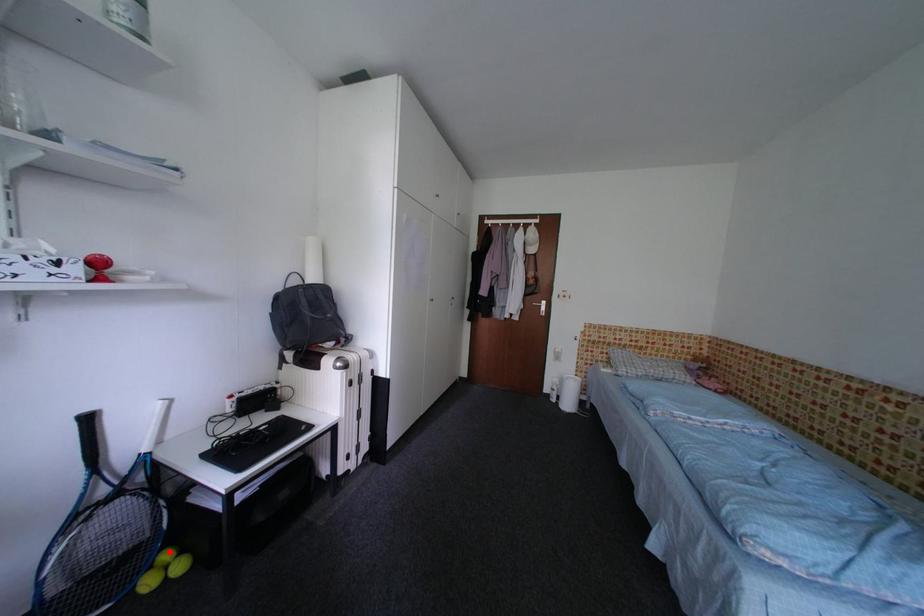
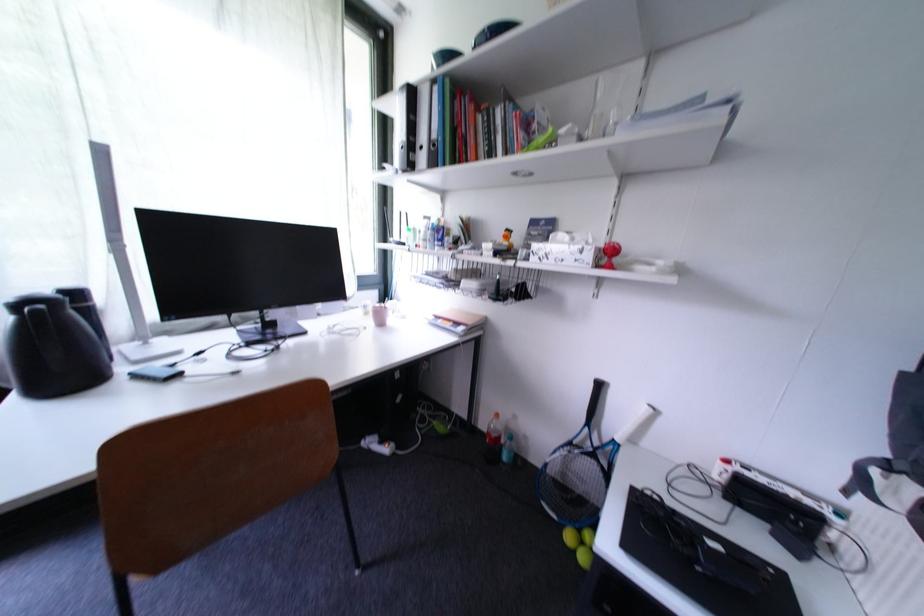
Question: I am providing you with two images of the same scene from different viewpoints. A red point is marked on the first image. At the location where the point appears in image 1, is it still visible in image 2?

Choices:
 (A) Yes
 (B) No

Answer: (B)